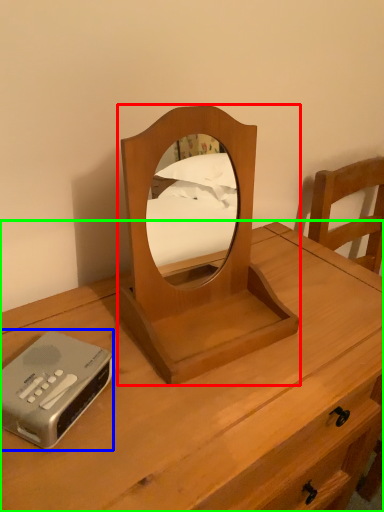
Question: Estimate the real-world distances between objects in this image. Which object is farther from mirror (highlighted by a red box), cassette (highlighted by a blue box) or nightstand (highlighted by a green box)?

Choices:
 (A) cassette
 (B) nightstand

Answer: (A)